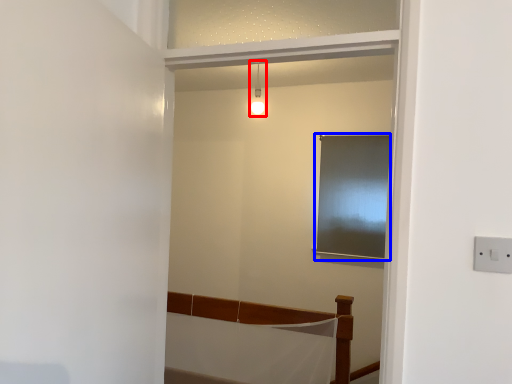
Question: Which of the following is the closest to the observer, light fixture (highlighted by a red box) or window (highlighted by a blue box)?

Choices:
 (A) light fixture
 (B) window

Answer: (A)